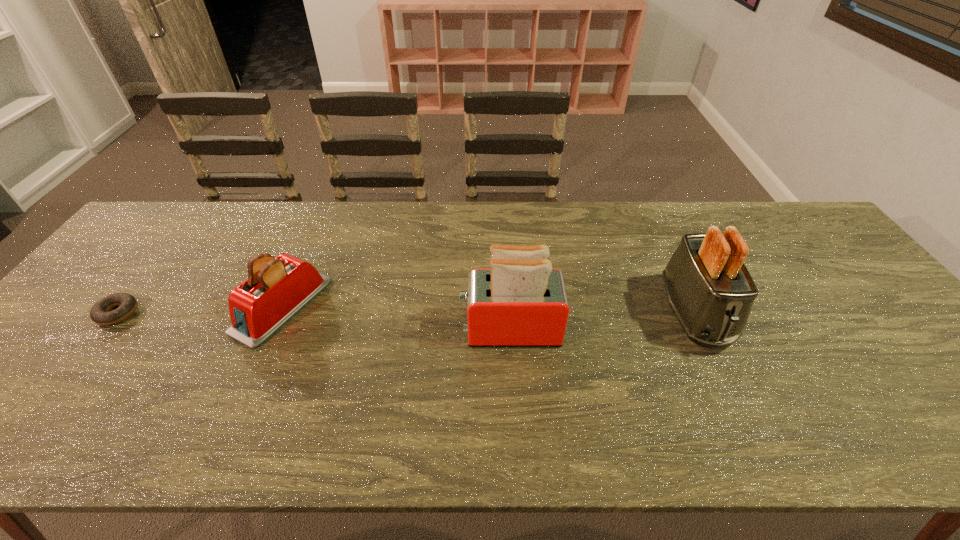
Find the location of a particular element. free space that satisfies the following two spatial constraints: 1. on the side of the rightmost object with the control lever; 2. on the front-facing side of the second object from right to left is located at coordinates (702, 329).

Identify the location of free space that satisfies the following two spatial constraints: 1. on the side of the rightmost toaster with the control lever; 2. on the front-facing side of the second object from right to left. Image resolution: width=960 pixels, height=540 pixels. (702, 329).